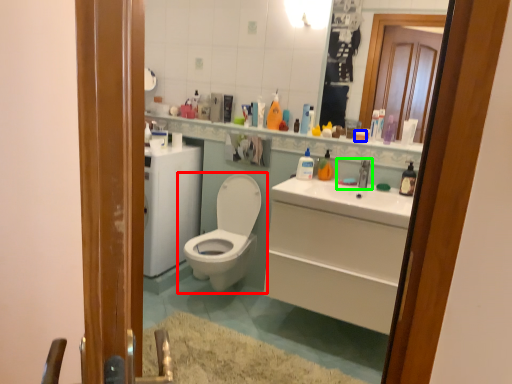
Question: Estimate the real-world distances between objects in this image. Which object is farther from toilet (highlighted by a red box), toiletry (highlighted by a blue box) or sink (highlighted by a green box)?

Choices:
 (A) toiletry
 (B) sink

Answer: (A)